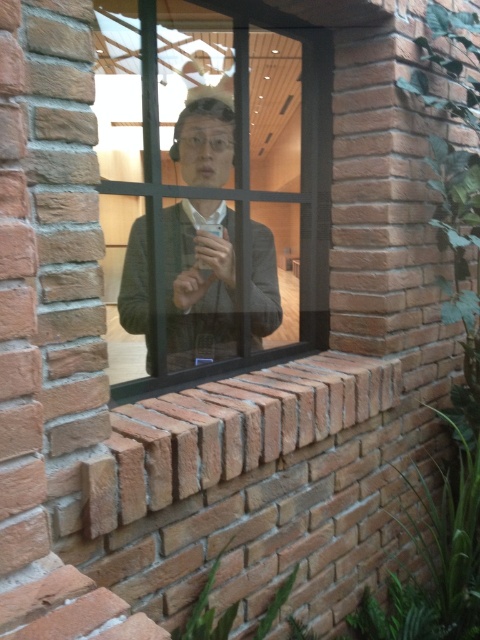
Question: Considering the relative positions of clear glass window at center and matte black jacket at center in the image provided, where is clear glass window at center located with respect to matte black jacket at center?

Choices:
 (A) below
 (B) above

Answer: (B)

Question: Is clear glass window at center positioned at the back of matte black jacket at center?

Choices:
 (A) no
 (B) yes

Answer: (A)

Question: Which point is closer to the camera?

Choices:
 (A) (190, 202)
 (B) (94, 4)

Answer: (B)

Question: Can you confirm if clear glass window at center is positioned to the left of matte black jacket at center?

Choices:
 (A) yes
 (B) no

Answer: (B)